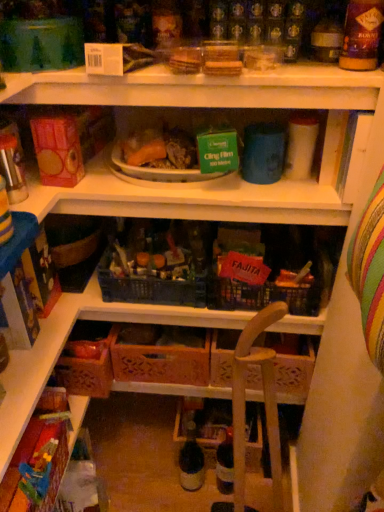
Where is `wooden crate at center`? Image resolution: width=384 pixels, height=512 pixels. wooden crate at center is located at coordinates (161, 354).

The width and height of the screenshot is (384, 512). In order to click on translucent glass bottle at center in this screenshot , I will do `click(191, 461)`.

Find the location of `wooden crate at center`. wooden crate at center is located at coordinates (161, 354).

At what (x,y) coordinates should I click in order to perform the action: click on food that is above the wooden crate at center (from a real-world perspective). Please return your answer as a coordinate pair (x, y). This screenshot has width=384, height=512. Looking at the image, I should click on (160, 150).

Does wooden crate at center lie behind orange plastic bowl at center?

Yes, wooden crate at center is further from the viewer.

Considering the points (145, 350) and (168, 146), which point is in front, point (145, 350) or point (168, 146)?

Positioned in front is point (168, 146).

This screenshot has height=512, width=384. In order to click on food that appears on the left of translucent glass bottle at center in this screenshot , I will do `click(160, 150)`.

Can you confirm if translucent glass bottle at center is taller than orange plastic bowl at center?

Yes, translucent glass bottle at center is taller than orange plastic bowl at center.

From the image's perspective, does translucent glass bottle at center appear lower than orange plastic bowl at center?

Yes, from the image's perspective, translucent glass bottle at center is below orange plastic bowl at center.

Would you consider translucent glass bottle at center to be distant from orange plastic bowl at center?

Actually, translucent glass bottle at center and orange plastic bowl at center are a little close together.

Where is `bottle below the wooden crate at center (from the image's perspective)`? bottle below the wooden crate at center (from the image's perspective) is located at coordinates (191, 461).

Is wooden crate at center in contact with translucent glass bottle at center?

No, wooden crate at center is not touching translucent glass bottle at center.

Which point is more forward, (123,380) or (180,452)?

The point (123,380) is closer to the camera.

In terms of width, does wooden crate at center look wider or thinner when compared to translucent glass bottle at center?

Clearly, wooden crate at center has more width compared to translucent glass bottle at center.

Is multicolored fabric toy at lower left next to white plastic plate at upper center?

multicolored fabric toy at lower left and white plastic plate at upper center are not in contact.

Is multicolored fabric toy at lower left completely or partially outside of white plastic plate at upper center?

Yes, multicolored fabric toy at lower left is not within white plastic plate at upper center.

Which of these two, multicolored fabric toy at lower left or white plastic plate at upper center, is thinner?

With smaller width is multicolored fabric toy at lower left.

Consider the image. Is multicolored fabric toy at lower left closer to the viewer compared to white plastic plate at upper center?

Yes, it is in front of white plastic plate at upper center.

Is orange plastic bowl at center touching wooden crate at center?

No, orange plastic bowl at center is not touching wooden crate at center.

From the image's perspective, which one is positioned lower, orange plastic bowl at center or wooden crate at center?

wooden crate at center, from the image's perspective.

Is orange plastic bowl at center aimed at wooden crate at center?

No, orange plastic bowl at center does not turn towards wooden crate at center.

Between orange plastic bowl at center and wooden crate at center, which one has more height?

Standing taller between the two is wooden crate at center.

Does multicolored fabric toy at lower left have a smaller size compared to orange plastic bowl at center?

Correct, multicolored fabric toy at lower left occupies less space than orange plastic bowl at center.

Is orange plastic bowl at center a part of multicolored fabric toy at lower left?

Actually, orange plastic bowl at center is outside multicolored fabric toy at lower left.

Find the location of a particular element. The width and height of the screenshot is (384, 512). toy lying in front of the orange plastic bowl at center is located at coordinates (38, 472).

Can you confirm if multicolored fabric toy at lower left is wider than orange plastic bowl at center?

No, multicolored fabric toy at lower left is not wider than orange plastic bowl at center.

Locate an element on the screen. food above the white plastic plate at upper center (from the image's perspective) is located at coordinates (160, 150).

Does white plastic plate at upper center turn towards orange plastic bowl at center?

No, white plastic plate at upper center does not turn towards orange plastic bowl at center.

From the image's perspective, is white plastic plate at upper center positioned above or below orange plastic bowl at center?

Based on their image positions, white plastic plate at upper center is located beneath orange plastic bowl at center.

This screenshot has height=512, width=384. I want to click on food on the left of the wooden crate at center, so click(160, 150).

Find the location of a particular element. This screenshot has height=512, width=384. food above the translucent glass bottle at center (from a real-world perspective) is located at coordinates (160, 150).

Looking at the image, which one is located closer to white plastic plate at upper center, wooden crate at center or translucent glass bottle at center?

Based on the image, wooden crate at center appears to be nearer to white plastic plate at upper center.

Which object lies nearer to the anchor point wooden crate at center, orange plastic bowl at center or white plastic plate at upper center?

Among the two, white plastic plate at upper center is located nearer to wooden crate at center.

When comparing their distances from translucent glass bottle at center, does multicolored fabric toy at lower left or orange plastic bowl at center seem further?

The object further to translucent glass bottle at center is orange plastic bowl at center.

Based on their spatial positions, is white plastic plate at upper center or orange plastic bowl at center closer to wooden crate at center?

white plastic plate at upper center lies closer to wooden crate at center than the other object.

Based on their spatial positions, is multicolored fabric toy at lower left or translucent glass bottle at center closer to white plastic plate at upper center?

multicolored fabric toy at lower left is positioned closer to the anchor white plastic plate at upper center.

From the picture: Considering their positions, is translucent glass bottle at center positioned closer to multicolored fabric toy at lower left than wooden crate at center?

The object closer to multicolored fabric toy at lower left is wooden crate at center.

In the scene shown: From the image, which object appears to be nearer to translucent glass bottle at center, white plastic plate at upper center or orange plastic bowl at center?

Based on the image, white plastic plate at upper center appears to be nearer to translucent glass bottle at center.

Based on their spatial positions, is white plastic plate at upper center or translucent glass bottle at center further from orange plastic bowl at center?

translucent glass bottle at center.

Where is `basket between orange plastic bowl at center and translucent glass bottle at center in the vertical direction`? The image size is (384, 512). basket between orange plastic bowl at center and translucent glass bottle at center in the vertical direction is located at coordinates (161, 354).

Where is `shelf between orange plastic bowl at center and translucent glass bottle at center in the vertical direction`? Image resolution: width=384 pixels, height=512 pixels. shelf between orange plastic bowl at center and translucent glass bottle at center in the vertical direction is located at coordinates (197, 197).

You are a GUI agent. You are given a task and a screenshot of the screen. Output one action in this format:
    pyautogui.click(x=<x>, y=<y>)
    Task: Click on the shelf between orange plastic bowl at center and wooden crate at center from top to bottom
    
    Given the screenshot: What is the action you would take?
    pyautogui.click(x=197, y=197)

Locate an element on the screen. The width and height of the screenshot is (384, 512). basket between multicolored fabric toy at lower left and translucent glass bottle at center along the z-axis is located at coordinates (161, 354).